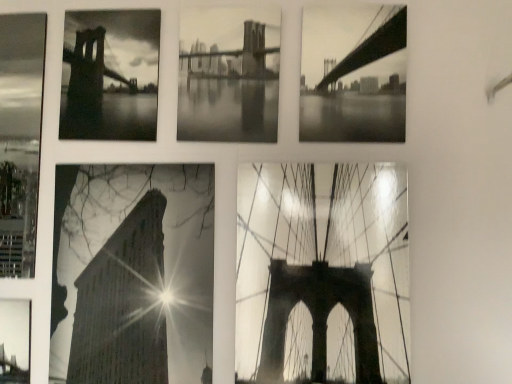
Question: Is metallic bridge at bottom left, which ranks as the first picture frame in left-to-right order, oriented away from monochrome bridge at upper right, arranged as the 1th picture frame when viewed from the right?

Choices:
 (A) no
 (B) yes

Answer: (A)

Question: From a real-world perspective, is metallic bridge at bottom left, which ranks as the first picture frame in left-to-right order, positioned under monochrome bridge at upper right, arranged as the 1th picture frame when viewed from the right, based on gravity?

Choices:
 (A) no
 (B) yes

Answer: (B)

Question: Is metallic bridge at bottom left, which ranks as the first picture frame in left-to-right order, completely or partially outside of monochrome bridge at upper right, the sixth picture frame in the left-to-right sequence?

Choices:
 (A) no
 (B) yes

Answer: (B)

Question: Can you see metallic bridge at bottom left, which ranks as the first picture frame in left-to-right order, touching monochrome bridge at upper right, arranged as the 1th picture frame when viewed from the right?

Choices:
 (A) no
 (B) yes

Answer: (A)

Question: Is metallic bridge at bottom left, which is the 6th picture frame in right-to-left order, positioned behind monochrome bridge at upper right, arranged as the 1th picture frame when viewed from the right?

Choices:
 (A) yes
 (B) no

Answer: (A)

Question: Can you confirm if metallic bridge at bottom left, which is the 6th picture frame in right-to-left order, is thinner than monochrome bridge at upper right, the sixth picture frame in the left-to-right sequence?

Choices:
 (A) yes
 (B) no

Answer: (A)

Question: Can you confirm if matte glass bridge at center, acting as the 2th picture frame starting from the right, is positioned to the left of high contrast paper building at bottom left, the 4th picture frame in the right-to-left sequence?

Choices:
 (A) yes
 (B) no

Answer: (B)

Question: From a real-world perspective, does matte glass bridge at center, which is the 5th picture frame in left-to-right order, stand above high contrast paper building at bottom left, the 4th picture frame in the right-to-left sequence?

Choices:
 (A) no
 (B) yes

Answer: (B)

Question: Does matte glass bridge at center, which is the 5th picture frame in left-to-right order, come behind high contrast paper building at bottom left, the 3th picture frame in the left-to-right sequence?

Choices:
 (A) no
 (B) yes

Answer: (A)

Question: Is matte glass bridge at center, which is the 5th picture frame in left-to-right order, facing away from high contrast paper building at bottom left, the 4th picture frame in the right-to-left sequence?

Choices:
 (A) no
 (B) yes

Answer: (A)

Question: Does matte glass bridge at center, acting as the 2th picture frame starting from the right, have a lesser width compared to high contrast paper building at bottom left, the 4th picture frame in the right-to-left sequence?

Choices:
 (A) no
 (B) yes

Answer: (A)

Question: From a real-world perspective, is matte glass bridge at center, acting as the 2th picture frame starting from the right, below high contrast paper building at bottom left, the 3th picture frame in the left-to-right sequence?

Choices:
 (A) yes
 (B) no

Answer: (B)

Question: From a real-world perspective, does monochrome paper brooklyn bridge at center, marked as the 3th picture frame in a right-to-left arrangement, sit lower than high contrast paper building at bottom left, the 3th picture frame in the left-to-right sequence?

Choices:
 (A) no
 (B) yes

Answer: (A)